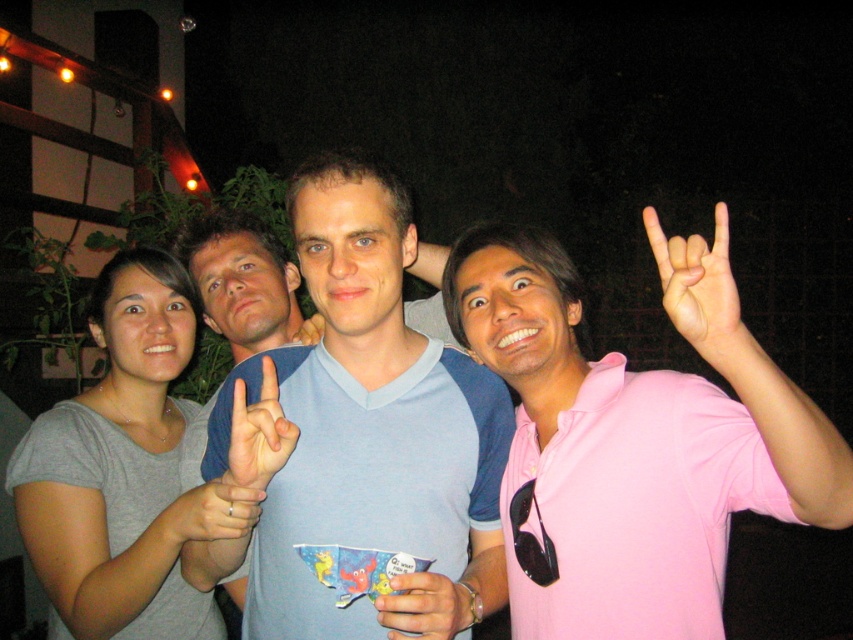
Does gray cotton shirt at left have a lesser width compared to white matte hand at center?

No, gray cotton shirt at left is not thinner than white matte hand at center.

Can you confirm if gray cotton shirt at left is positioned to the left of white matte hand at center?

Indeed, gray cotton shirt at left is positioned on the left side of white matte hand at center.

Where is `gray cotton shirt at left`? The height and width of the screenshot is (640, 853). gray cotton shirt at left is located at coordinates (125, 472).

Is matte pink hand at upper right positioned in front of matte blue shirt at center?

Yes.

At what (x,y) coordinates should I click in order to perform the action: click on matte pink hand at upper right. Please return your answer as a coordinate pair (x, y). The height and width of the screenshot is (640, 853). Looking at the image, I should click on (701, 292).

Who is higher up, pink cotton shirt at right or gray cotton shirt at left?

pink cotton shirt at right is above.

Is pink cotton shirt at right behind gray cotton shirt at left?

No.

At what (x,y) coordinates should I click in order to perform the action: click on pink cotton shirt at right. Please return your answer as a coordinate pair (x, y). The image size is (853, 640). Looking at the image, I should click on (645, 428).